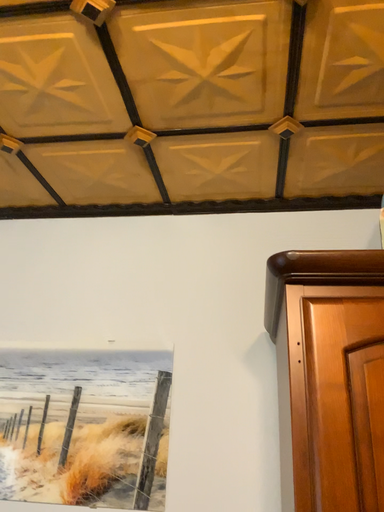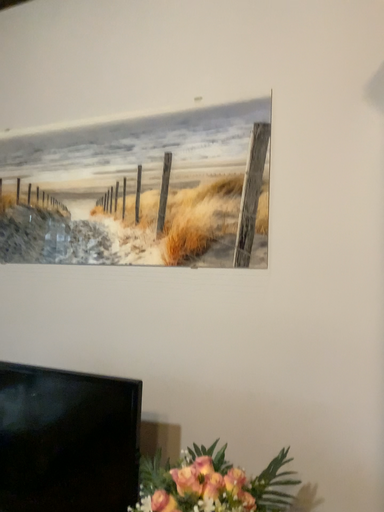
Question: How did the camera likely rotate when shooting the video?

Choices:
 (A) rotated upward
 (B) rotated downward

Answer: (B)